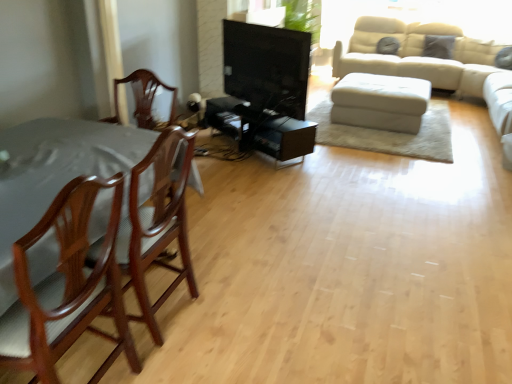
Question: From the image's perspective, would you say white leather ottoman at center is positioned over black glossy tv stand at center?

Choices:
 (A) yes
 (B) no

Answer: (B)

Question: From the image's perspective, is white leather ottoman at center beneath black glossy tv stand at center?

Choices:
 (A) yes
 (B) no

Answer: (A)

Question: Considering the relative sizes of white leather ottoman at center and black glossy tv stand at center in the image provided, is white leather ottoman at center shorter than black glossy tv stand at center?

Choices:
 (A) yes
 (B) no

Answer: (A)

Question: Is black glossy tv stand at center completely or partially inside white leather ottoman at center?

Choices:
 (A) yes
 (B) no

Answer: (B)

Question: Is white leather ottoman at center further to camera compared to black glossy tv stand at center?

Choices:
 (A) no
 (B) yes

Answer: (B)

Question: Does white leather ottoman at center have a larger size compared to black glossy tv stand at center?

Choices:
 (A) yes
 (B) no

Answer: (A)

Question: Can you confirm if white leather ottoman at center is taller than mahogany wood chair at left, the second chair positioned from the back?

Choices:
 (A) no
 (B) yes

Answer: (A)

Question: Would you say white leather ottoman at center is a long distance from mahogany wood chair at left, the second chair positioned from the back?

Choices:
 (A) yes
 (B) no

Answer: (A)

Question: Is white leather ottoman at center closer to the viewer compared to mahogany wood chair at left, the first chair positioned from the front?

Choices:
 (A) yes
 (B) no

Answer: (B)

Question: Considering the relative positions of white leather ottoman at center and mahogany wood chair at left, the first chair positioned from the front, in the image provided, is white leather ottoman at center to the right of mahogany wood chair at left, the first chair positioned from the front, from the viewer's perspective?

Choices:
 (A) yes
 (B) no

Answer: (A)

Question: From the image's perspective, is white leather ottoman at center beneath mahogany wood chair at left, the second chair positioned from the back?

Choices:
 (A) no
 (B) yes

Answer: (A)

Question: From the image's perspective, is white leather ottoman at center on mahogany wood chair at left, the second chair positioned from the back?

Choices:
 (A) no
 (B) yes

Answer: (B)

Question: Does mahogany wood chair at left, which is the first chair from back to front, lie in front of white leather ottoman at center?

Choices:
 (A) no
 (B) yes

Answer: (B)